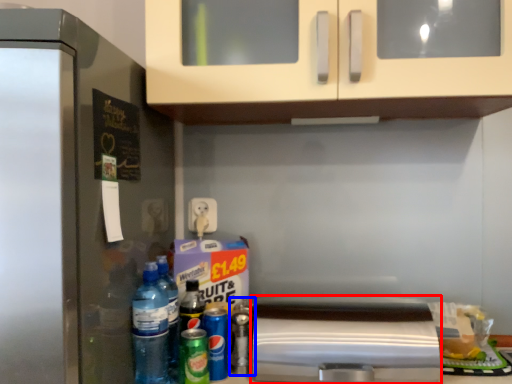
Question: Which point is further to the camera, appliance (highlighted by a red box) or bottle (highlighted by a blue box)?

Choices:
 (A) appliance
 (B) bottle

Answer: (B)